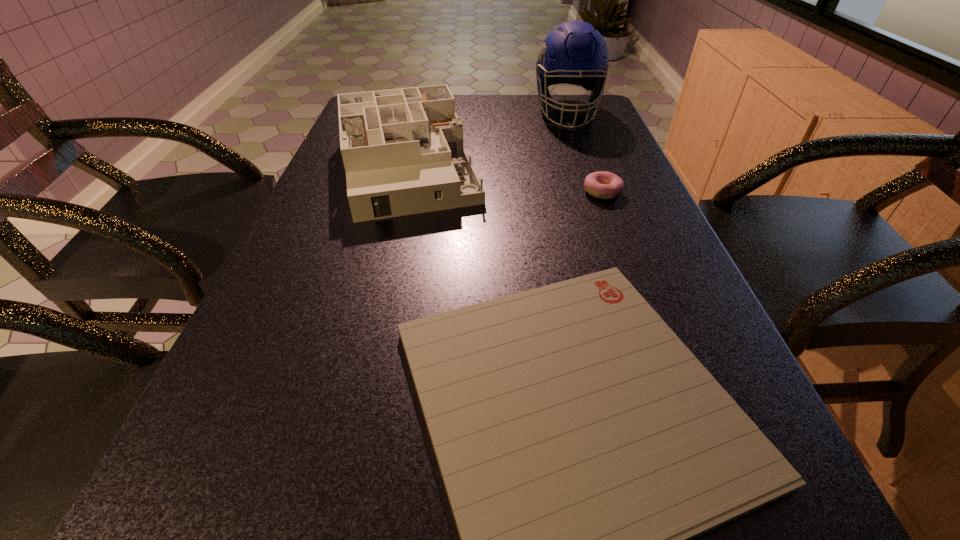
I want to click on object identified as the second closest to the third shortest object, so click(x=582, y=445).

Identify which object is located as the second nearest to the dollhouse. Please provide its 2D coordinates. Your answer should be formatted as a tuple, i.e. [(x, y)], where the tuple contains the x and y coordinates of a point satisfying the conditions above.

[(582, 445)]

I want to click on blank area in the image that satisfies the following two spatial constraints: 1. on the front-facing side of the tallest object; 2. on the left side of the third tallest object, so click(595, 192).

You are a GUI agent. You are given a task and a screenshot of the screen. Output one action in this format:
    pyautogui.click(x=<x>, y=<y>)
    Task: Click on the free space that satisfies the following two spatial constraints: 1. on the front-facing side of the second shortest object; 2. on the left side of the tallest object
    
    Given the screenshot: What is the action you would take?
    pyautogui.click(x=595, y=192)